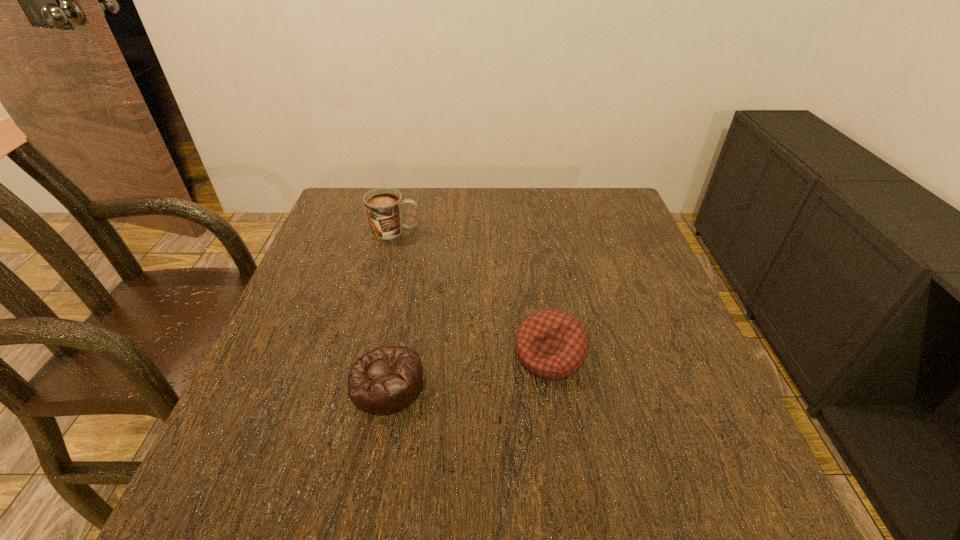
At what (x,y) coordinates should I click in order to perform the action: click on object that is at the left edge. Please return your answer as a coordinate pair (x, y). This screenshot has height=540, width=960. Looking at the image, I should click on (384, 206).

I want to click on object that is at the far left corner, so click(384, 206).

The height and width of the screenshot is (540, 960). I want to click on vacant space at the far edge of the desktop, so click(459, 201).

I want to click on free space at the near edge of the desktop, so click(x=464, y=495).

Image resolution: width=960 pixels, height=540 pixels. What are the coordinates of `vacant space at the right edge of the desktop` in the screenshot? It's located at (650, 363).

Where is `blank space at the far right corner of the desktop`? Image resolution: width=960 pixels, height=540 pixels. blank space at the far right corner of the desktop is located at coordinates (592, 197).

Where is `vacant area between the farthest object and the rightmost object`? Image resolution: width=960 pixels, height=540 pixels. vacant area between the farthest object and the rightmost object is located at coordinates (473, 293).

Find the location of a particular element. vacant area between the farthest object and the shorter beanbag is located at coordinates (392, 307).

Locate an element on the screen. unoccupied area between the shortest object and the mug is located at coordinates coord(392,307).

Locate an element on the screen. This screenshot has height=540, width=960. vacant area between the rightmost object and the shortest object is located at coordinates (468, 369).